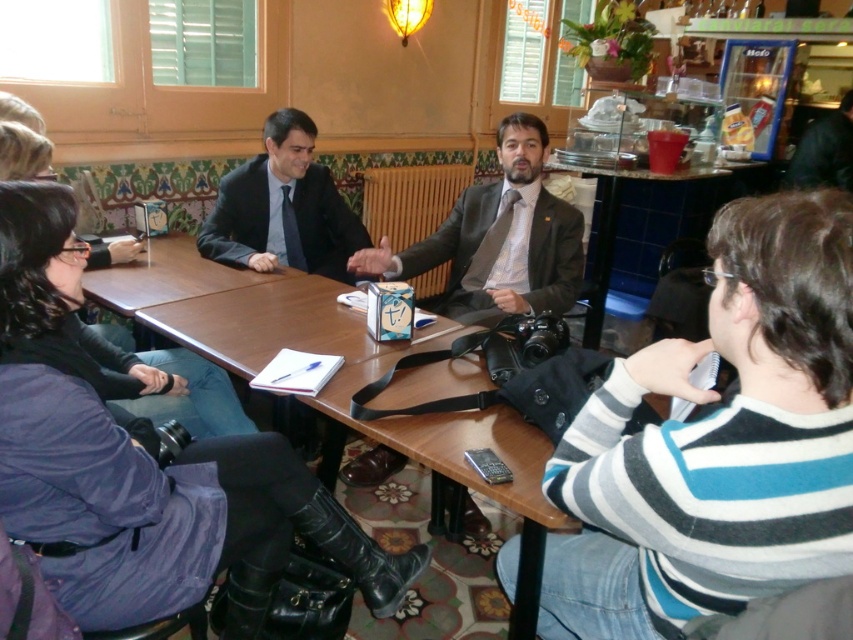
You are a photographer at the event and need to capture a photo of the dark gray suit at center without the matte purple coat at lower left blocking the view. Can you adjust your position to do so?

The matte purple coat at lower left is in front of the dark gray suit at center, so moving to a position behind the matte purple coat at lower left would allow you to see the dark gray suit at center without obstruction.